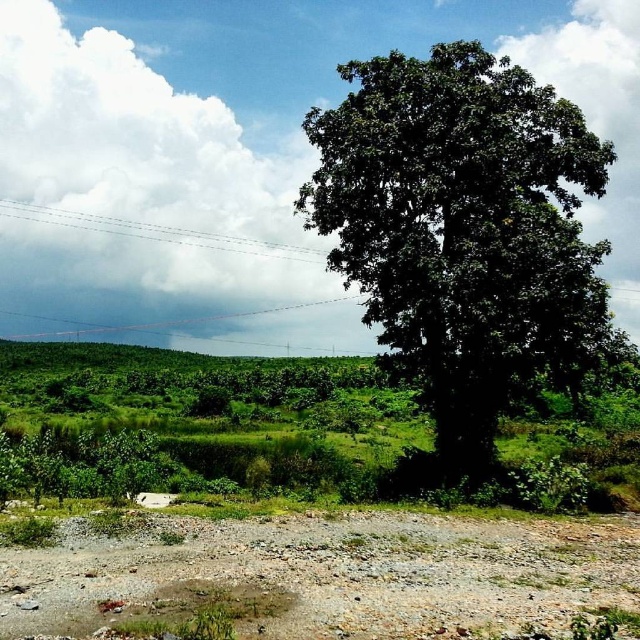
Question: Can you confirm if green leafy tree at right is bigger than dull brown gravel at lower center?

Choices:
 (A) yes
 (B) no

Answer: (A)

Question: Which point is closer to the camera?

Choices:
 (A) dull brown gravel at lower center
 (B) green leafy tree at right

Answer: (A)

Question: Is green leafy tree at right bigger than dull brown gravel at lower center?

Choices:
 (A) no
 (B) yes

Answer: (B)

Question: Considering the relative positions of green leafy tree at right and dull brown gravel at lower center in the image provided, where is green leafy tree at right located with respect to dull brown gravel at lower center?

Choices:
 (A) left
 (B) right

Answer: (B)

Question: Which of the following is the closest to the observer?

Choices:
 (A) dull brown gravel at lower center
 (B) green leafy tree at right

Answer: (A)

Question: Which object appears farthest from the camera in this image?

Choices:
 (A) green leafy tree at right
 (B) dull brown gravel at lower center

Answer: (A)